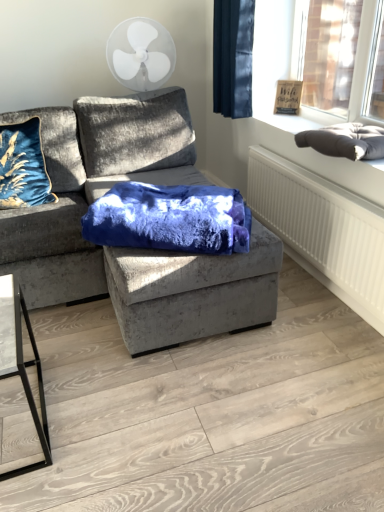
This screenshot has width=384, height=512. I want to click on free space in front of matte brown wooden picture frame at upper right, so click(288, 115).